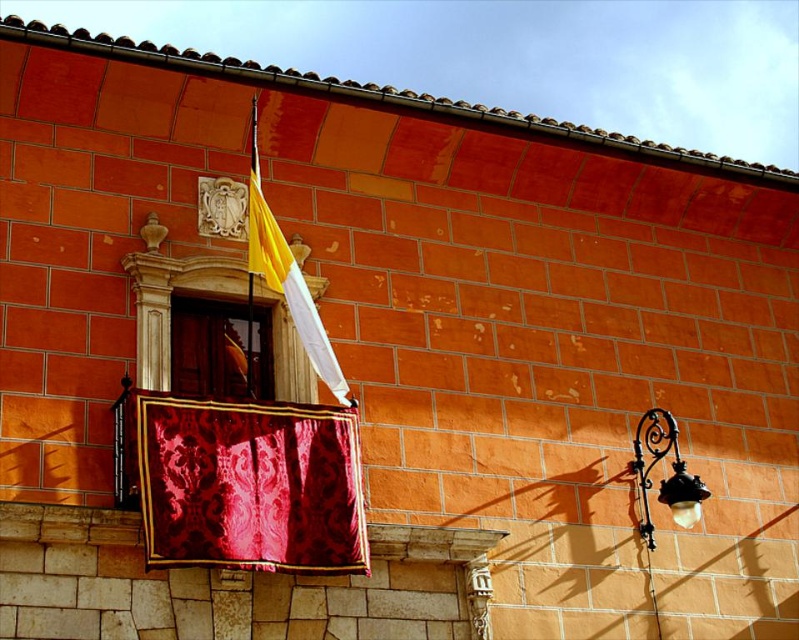
Is velvet damask curtain at center wider than yellow fabric flag at upper center?

Incorrect, velvet damask curtain at center's width does not surpass yellow fabric flag at upper center's.

Which is behind, point (293, 538) or point (259, 228)?

Positioned behind is point (259, 228).

Is point (248, 508) in front of point (256, 221)?

Yes, point (248, 508) is in front of point (256, 221).

Where is `velvet damask curtain at center`? Image resolution: width=799 pixels, height=640 pixels. velvet damask curtain at center is located at coordinates (249, 484).

Is yellow fabric flag at upper center wider than black wrought iron streetlight at right?

Indeed, yellow fabric flag at upper center has a greater width compared to black wrought iron streetlight at right.

Identify the location of yellow fabric flag at upper center. The image size is (799, 640). (289, 285).

Between point (309, 298) and point (646, 538), which one is positioned in front?

Positioned in front is point (309, 298).

I want to click on yellow fabric flag at upper center, so [289, 285].

Is point (245, 340) behind point (662, 492)?

No.

Between wooden door at center and black wrought iron streetlight at right, which one appears on the left side from the viewer's perspective?

wooden door at center

Does point (211, 337) lie behind point (666, 454)?

That is False.

You are a GUI agent. You are given a task and a screenshot of the screen. Output one action in this format:
    pyautogui.click(x=<x>, y=<y>)
    Task: Click on the wooden door at center
    
    Given the screenshot: What is the action you would take?
    pyautogui.click(x=221, y=348)